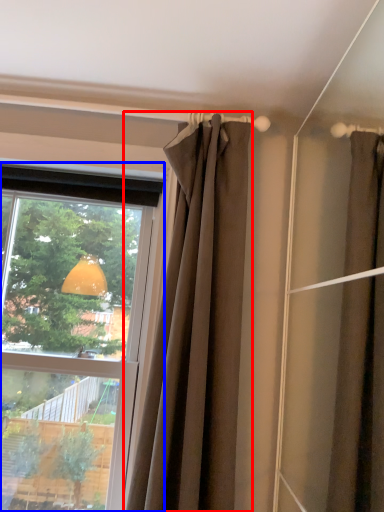
Question: Among these objects, which one is nearest to the camera, curtain (highlighted by a red box) or window (highlighted by a blue box)?

Choices:
 (A) curtain
 (B) window

Answer: (A)